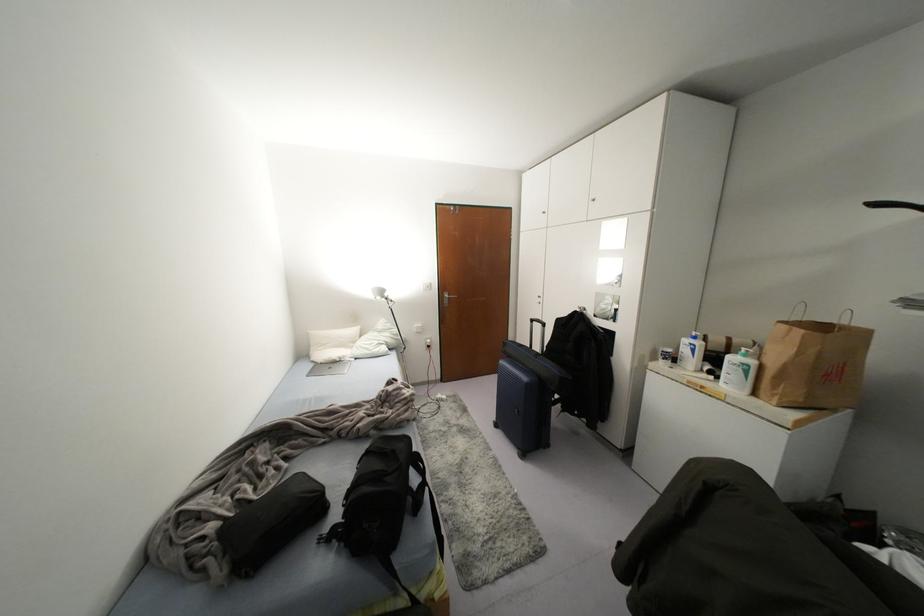
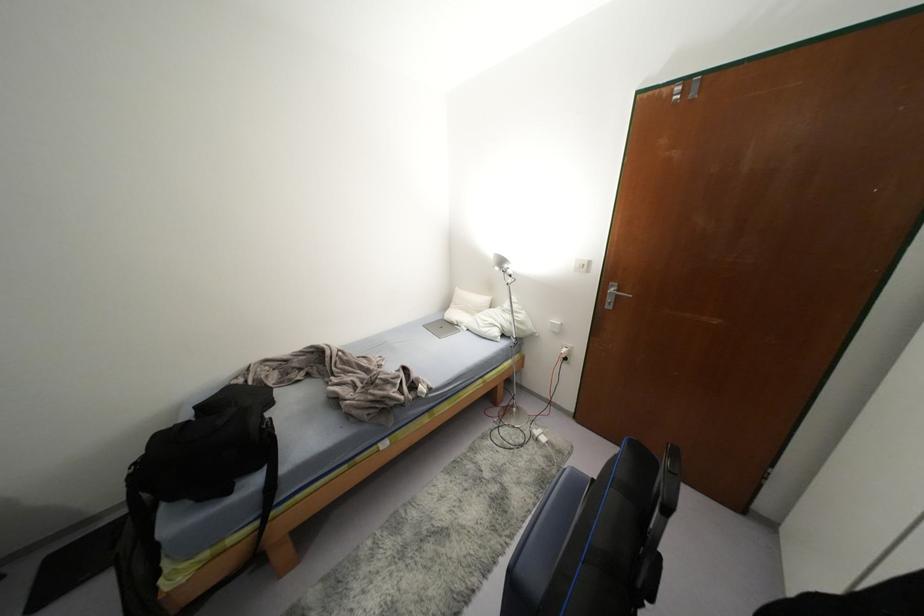
Find the pixel in the second image that matches pixel 354 330 in the first image.

(484, 299)